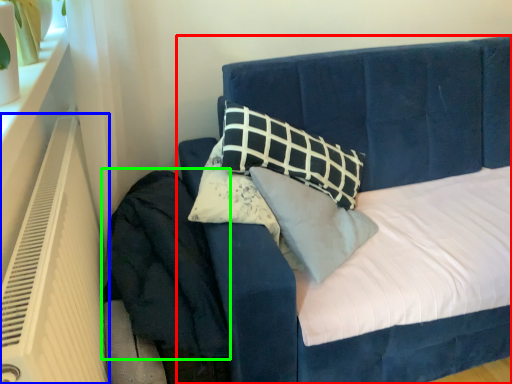
Question: Which object is positioned closest to bed (highlighted by a red box)? Select from heater (highlighted by a blue box) and velvet (highlighted by a green box).

Choices:
 (A) heater
 (B) velvet

Answer: (B)